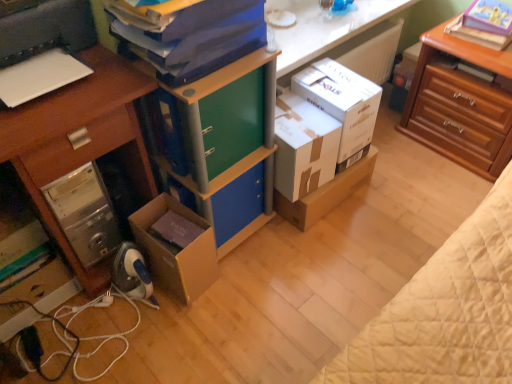
Question: Considering the relative sizes of white plastic printer at left and blue matte folder at upper center in the image provided, is white plastic printer at left bigger than blue matte folder at upper center?

Choices:
 (A) yes
 (B) no

Answer: (A)

Question: Does white plastic printer at left turn towards blue matte folder at upper center?

Choices:
 (A) yes
 (B) no

Answer: (B)

Question: Can you confirm if white plastic printer at left is wider than blue matte folder at upper center?

Choices:
 (A) yes
 (B) no

Answer: (A)

Question: Is white plastic printer at left smaller than blue matte folder at upper center?

Choices:
 (A) yes
 (B) no

Answer: (B)

Question: From the image's perspective, would you say white plastic printer at left is shown under blue matte folder at upper center?

Choices:
 (A) yes
 (B) no

Answer: (A)

Question: Would you say white cardboard box at center, which is counted as the third box, starting from the left, is inside or outside white cardboard box at center, the 2th box from the left?

Choices:
 (A) outside
 (B) inside

Answer: (A)

Question: From their relative heights in the image, would you say white cardboard box at center, positioned as the first box in right-to-left order, is taller or shorter than white cardboard box at center, the 2th box from the left?

Choices:
 (A) tall
 (B) short

Answer: (A)

Question: Looking at the image, does white cardboard box at center, which is counted as the third box, starting from the left, seem bigger or smaller compared to white cardboard box at center, the 2th box from the left?

Choices:
 (A) small
 (B) big

Answer: (A)

Question: From a real-world perspective, is white cardboard box at center, which is counted as the third box, starting from the left, above or below white cardboard box at center, placed as the second box when sorted from right to left?

Choices:
 (A) above
 (B) below

Answer: (A)

Question: Is white cardboard box at center, placed as the second box when sorted from right to left, to the left or to the right of white glossy counter top at upper center in the image?

Choices:
 (A) left
 (B) right

Answer: (A)

Question: In terms of width, does white cardboard box at center, the 2th box from the left, look wider or thinner when compared to white glossy counter top at upper center?

Choices:
 (A) thin
 (B) wide

Answer: (A)

Question: Relative to white glossy counter top at upper center, is white cardboard box at center, placed as the second box when sorted from right to left, in front or behind?

Choices:
 (A) front
 (B) behind

Answer: (A)

Question: From their relative heights in the image, would you say white cardboard box at center, placed as the second box when sorted from right to left, is taller or shorter than white glossy counter top at upper center?

Choices:
 (A) tall
 (B) short

Answer: (A)

Question: Considering the relative positions of white glossy counter top at upper center and cardboard box at lower left, acting as the 3th box starting from the right, in the image provided, is white glossy counter top at upper center to the left or to the right of cardboard box at lower left, acting as the 3th box starting from the right,?

Choices:
 (A) right
 (B) left

Answer: (A)

Question: Looking at their shapes, would you say white glossy counter top at upper center is wider or thinner than cardboard box at lower left, acting as the 3th box starting from the right?

Choices:
 (A) thin
 (B) wide

Answer: (B)